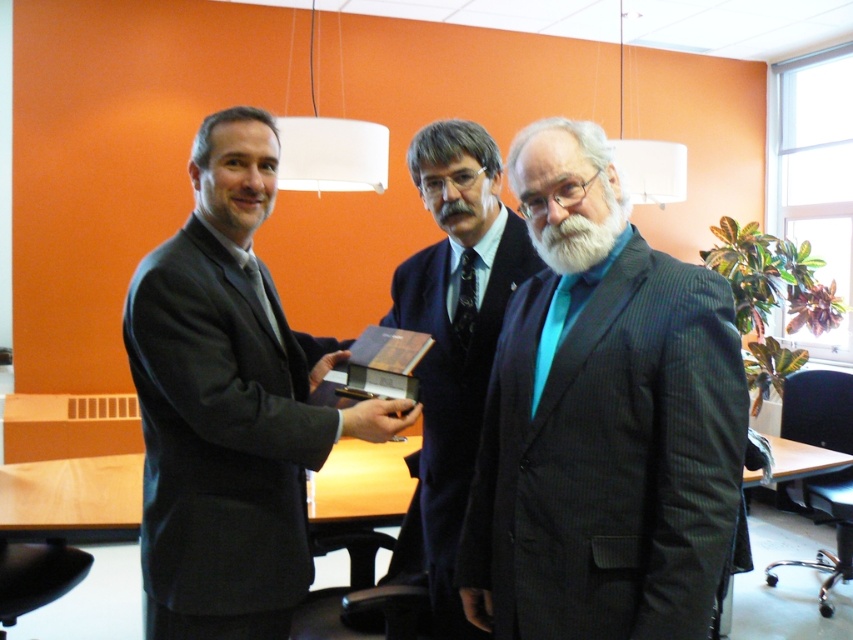
Question: Considering the real-world distances, which object is farthest from the dark gray pinstripe suit at center?

Choices:
 (A) dark blue suit at center
 (B) matte black suit at left

Answer: (B)

Question: Is matte black suit at left thinner than dark blue suit at center?

Choices:
 (A) no
 (B) yes

Answer: (A)

Question: Estimate the real-world distances between objects in this image. Which object is closer to the dark gray pinstripe suit at center?

Choices:
 (A) matte black suit at left
 (B) dark blue suit at center

Answer: (B)

Question: In this image, where is dark gray pinstripe suit at center located relative to dark blue suit at center?

Choices:
 (A) left
 (B) right

Answer: (B)

Question: Which is nearer to the dark blue suit at center?

Choices:
 (A) dark gray pinstripe suit at center
 (B) matte black suit at left

Answer: (A)

Question: Where is matte black suit at left located in relation to dark blue suit at center in the image?

Choices:
 (A) left
 (B) right

Answer: (A)